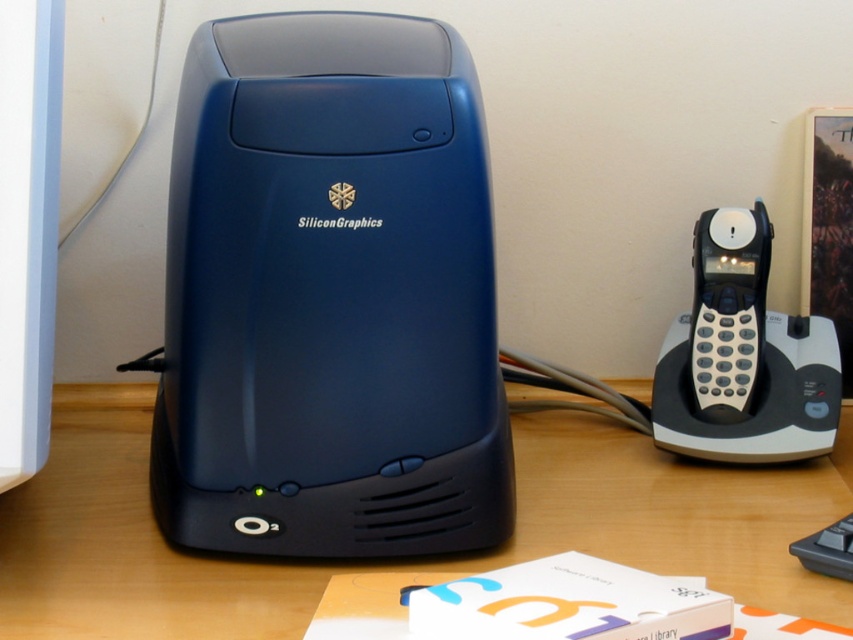
You are setting up a desk for a retro tech display. You have a matte blue desktop computer at center and a black plastic phone at right. According to the image, which object is placed higher up?

The matte blue desktop computer at center is positioned over the black plastic phone at right, so it is placed higher up.

You are setting up a workspace and need to place both the matte black table at center and the black plastic phone at right on a shelf. Which object should you place first to ensure there is enough space for both?

The matte black table at center is shorter than the black plastic phone at right, so you should place the black plastic phone at right first to accommodate its height and ensure both fit on the shelf.